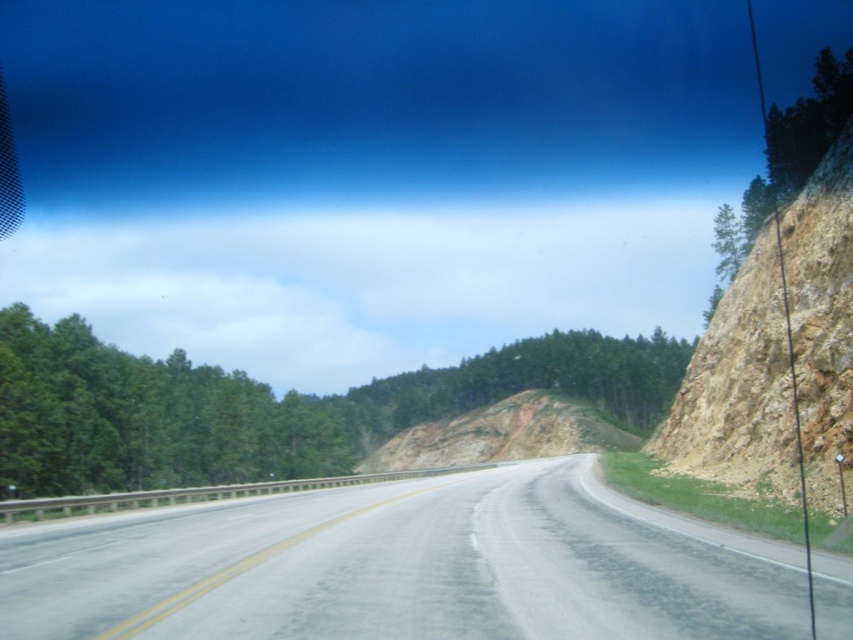
In the scene shown: Measure the distance between point (x=827, y=163) and camera.

A distance of 34.81 meters exists between point (x=827, y=163) and camera.

Is brown rocky hillside at right shorter than brown dirt hillside at center?

In fact, brown rocky hillside at right may be taller than brown dirt hillside at center.

The height and width of the screenshot is (640, 853). Find the location of `brown rocky hillside at right`. brown rocky hillside at right is located at coordinates (738, 390).

Does asphalt road at center have a lesser height compared to brown dirt hillside at center?

Correct, asphalt road at center is not as tall as brown dirt hillside at center.

Does asphalt road at center lie behind brown dirt hillside at center?

No, asphalt road at center is in front of brown dirt hillside at center.

Find the location of `asphalt road at center`. asphalt road at center is located at coordinates (403, 566).

Find the location of a particular element. asphalt road at center is located at coordinates pos(403,566).

Is asphalt road at center thinner than brown rocky hillside at right?

Yes.

Is point (73, 541) closer to viewer compared to point (845, 349)?

Yes, point (73, 541) is in front of point (845, 349).

Image resolution: width=853 pixels, height=640 pixels. I want to click on asphalt road at center, so [403, 566].